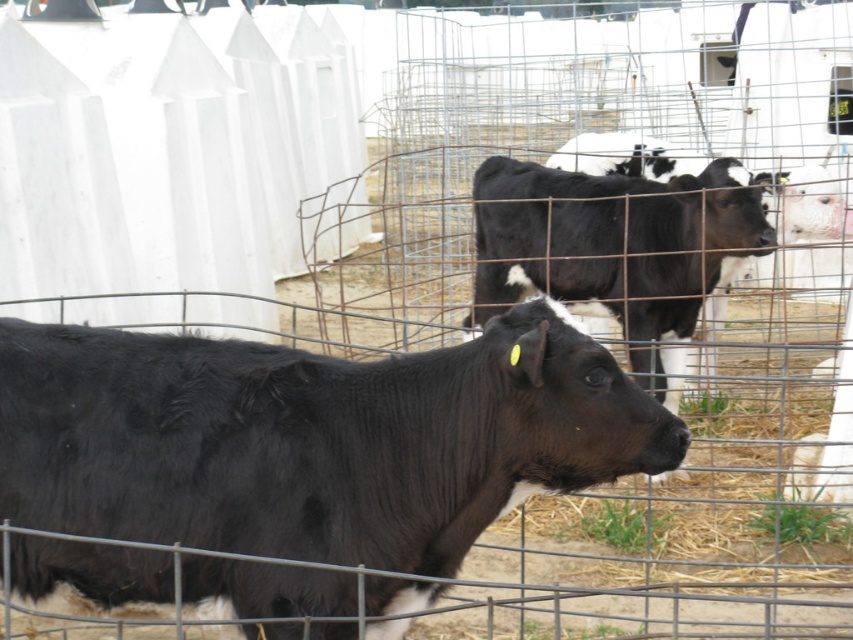
Question: Which point is closer to the camera taking this photo?

Choices:
 (A) [637, 275]
 (B) [341, 400]

Answer: (B)

Question: Does black glossy cow at center appear under black smooth cow at center?

Choices:
 (A) yes
 (B) no

Answer: (A)

Question: Does black glossy cow at center appear under black smooth cow at center?

Choices:
 (A) yes
 (B) no

Answer: (A)

Question: Which point is farther from the camera taking this photo?

Choices:
 (A) (62, 396)
 (B) (570, 193)

Answer: (B)

Question: Can you confirm if black glossy cow at center is positioned above black smooth cow at center?

Choices:
 (A) yes
 (B) no

Answer: (B)